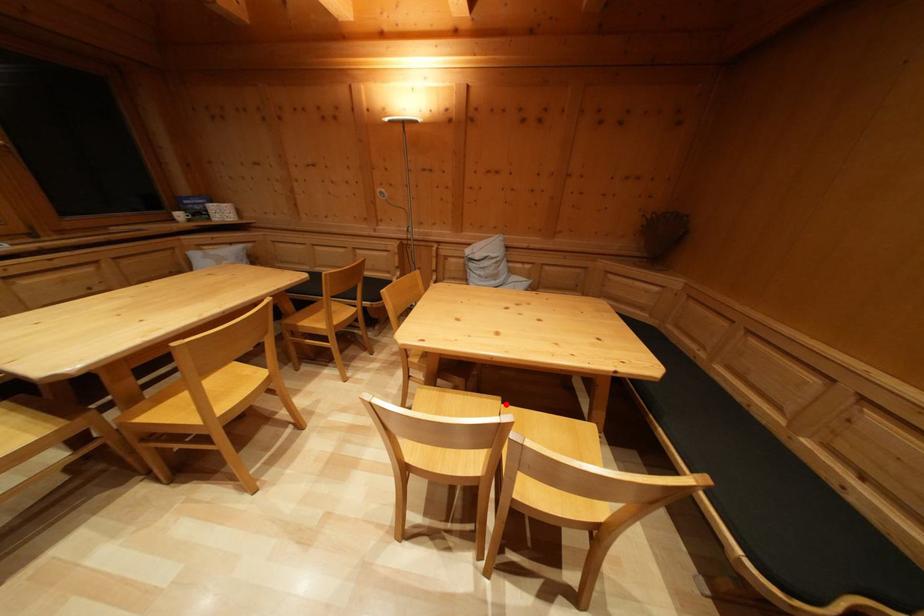
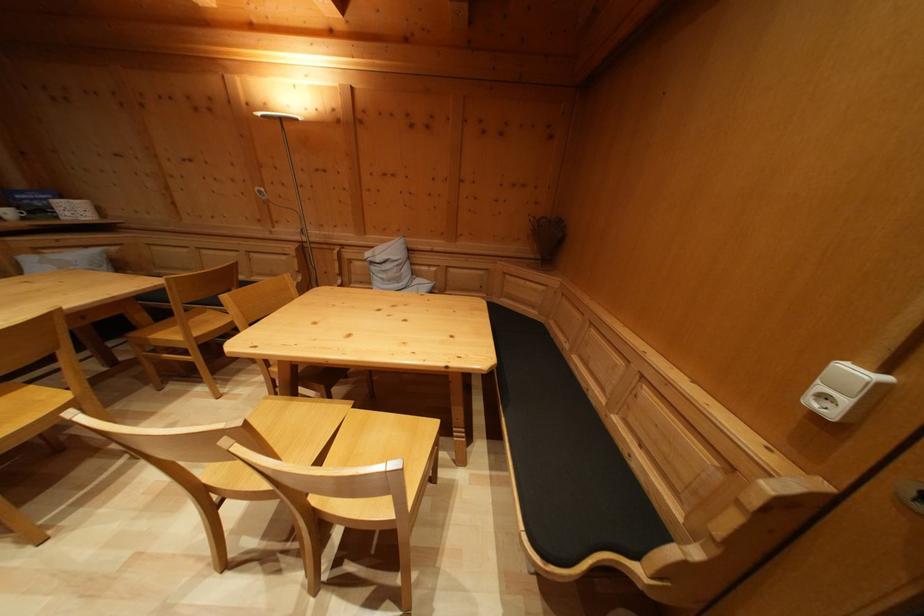
Locate, in the second image, the point that corresponds to the highlighted location in the first image.

(359, 408)